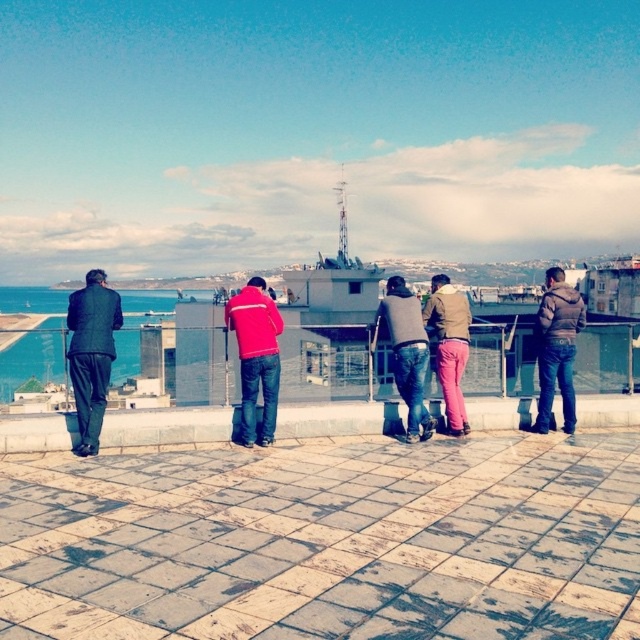
Question: Is dark gray suit at left above red fleece jacket at center?

Choices:
 (A) yes
 (B) no

Answer: (B)

Question: Observing the image, what is the correct spatial positioning of red fleece jacket at center in reference to brown leather jacket at right?

Choices:
 (A) below
 (B) above

Answer: (A)

Question: Which of the following is the closest to the observer?

Choices:
 (A) (548, 348)
 (B) (410, 292)
 (C) (280, 320)
 (D) (80, 324)

Answer: (D)

Question: Can you confirm if dark gray suit at left is smaller than red fleece jacket at center?

Choices:
 (A) no
 (B) yes

Answer: (A)

Question: Which point is closer to the camera taking this photo?

Choices:
 (A) (540, 332)
 (B) (99, 280)
 (C) (257, 356)
 (D) (433, 424)

Answer: (C)

Question: Among these points, which one is farthest from the camera?

Choices:
 (A) (106, 296)
 (B) (576, 307)
 (C) (276, 333)

Answer: (B)